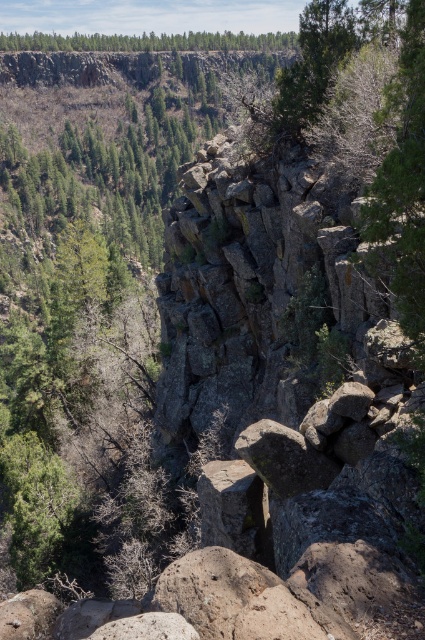
You are a hiker looking at the cliff and want to take a photo of the green textured tree at upper right and the green matte forest at upper center. Which object should you focus on first if you want both to be in the frame without moving the camera?

The green textured tree at upper right is positioned on the right side of green matte forest at upper center, so you should focus on the green matte forest at upper center first to ensure both are in the frame.

You are standing at the base of the cliff in the image. You see a point marked as point (312,64). Is this point located on the cliff face or in the foreground?

The point (312,64) is located on the cliff face because it corresponds to the green textured tree at upper right, which is part of the cliff structure.

You are planning a hiking route and need to know the distance between the green textured tree at upper right and the green matte forest at upper center. Can you confirm if the distance is more than 1000 feet?

The distance between the green textured tree at upper right and the green matte forest at upper center is 1140.61 feet, which is more than 1000 feet.